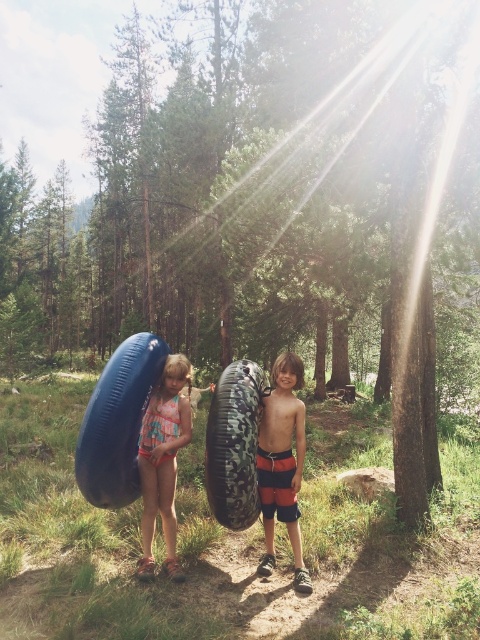
Between point (164, 348) and point (182, 362), which one is positioned in front?

Positioned in front is point (182, 362).

What do you see at coordinates (118, 422) in the screenshot?
I see `blue rubber tube at left` at bounding box center [118, 422].

The width and height of the screenshot is (480, 640). Identify the location of blue rubber tube at left. (118, 422).

From the picture: Is blue rubber tube at left positioned in front of orange striped shorts at center?

Yes, blue rubber tube at left is closer to the viewer.

Can you confirm if blue rubber tube at left is positioned above orange striped shorts at center?

Yes.

Describe the element at coordinates (118, 422) in the screenshot. I see `blue rubber tube at left` at that location.

I want to click on blue rubber tube at left, so click(x=118, y=422).

In the scene shown: Which is more to the right, camouflage rubber tube at center or multicolored swimsuit at left?

camouflage rubber tube at center is more to the right.

Can you confirm if camouflage rubber tube at center is thinner than multicolored swimsuit at left?

Yes.

Is point (236, 360) positioned in front of point (159, 464)?

No.

Where is `camouflage rubber tube at center`? camouflage rubber tube at center is located at coordinates (235, 444).